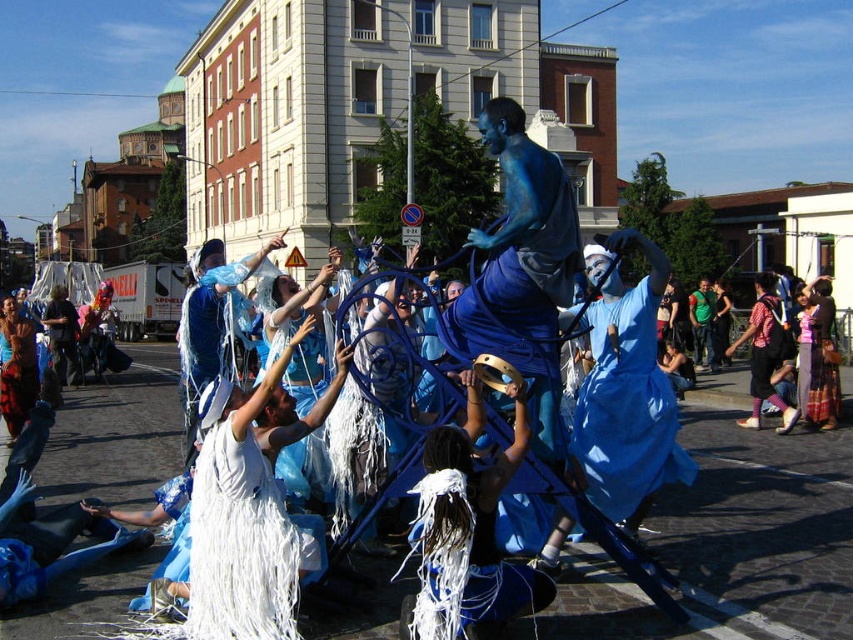
You are a photographer trying to capture the performers in the scene. You notice the white fringed dress at center and the plaid fabric shirt at lower right. Which clothing item should you focus on if you want to photograph something that is closer to the camera?

The white fringed dress at center should be focused on because it is shorter than the plaid fabric shirt at lower right, indicating it is closer to the camera.

You are a photographer trying to capture the height comparison between the white fringed fabric at lower center and the plaid fabric shirt at lower right. Which one appears shorter in the photo?

The white fringed fabric at lower center is not as tall as the plaid fabric shirt at lower right, so it appears shorter in the photo.

You are a photographer trying to capture the white fringed fabric at lower center and the plaid fabric shirt at lower right in the same frame. Which object is closer to the camera?

The white fringed fabric at lower center is positioned under the plaid fabric shirt at lower right, meaning it is closer to the camera since it is below and overlapping the shirt.